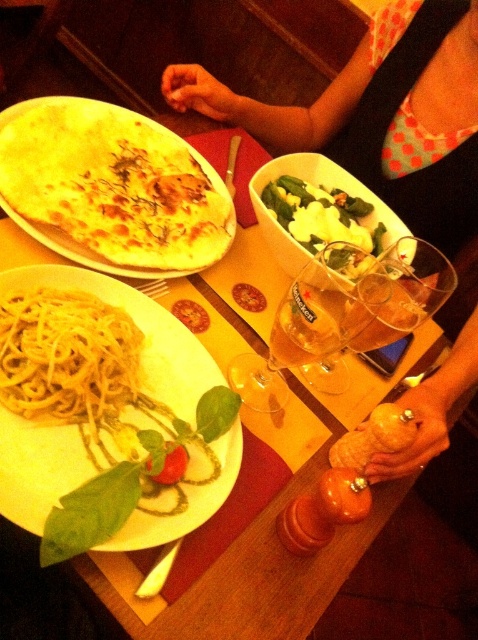
Identify the location of yellow matte pasta at center. (x=106, y=413).

The width and height of the screenshot is (478, 640). In order to click on yellow matte pasta at center in this screenshot , I will do `click(106, 413)`.

Can you confirm if yellow matte pasta at center is taller than yellow matte spaghetti at center?

Correct, yellow matte pasta at center is much taller as yellow matte spaghetti at center.

Does yellow matte pasta at center lie behind yellow matte spaghetti at center?

No, yellow matte pasta at center is closer to the viewer.

Describe the element at coordinates (106, 413) in the screenshot. I see `yellow matte pasta at center` at that location.

The width and height of the screenshot is (478, 640). I want to click on yellow matte pasta at center, so click(x=106, y=413).

Who is higher up, golden crispy pizza at upper left or green leafy salad at center?

Positioned higher is golden crispy pizza at upper left.

What do you see at coordinates (111, 188) in the screenshot? I see `golden crispy pizza at upper left` at bounding box center [111, 188].

This screenshot has width=478, height=640. In order to click on golden crispy pizza at upper left in this screenshot , I will do `click(111, 188)`.

The height and width of the screenshot is (640, 478). I want to click on golden crispy pizza at upper left, so click(111, 188).